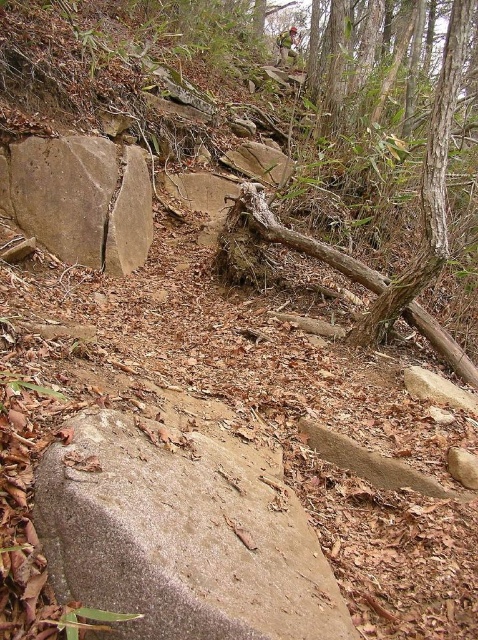
You are a hiker carrying a backpack and need to cross the path between the gray rough stone at center and the brown rough log at center. The path is narrow. If your backpack is 1.5 meters wide, can you safely pass through without touching either object?

The distance between the gray rough stone at center and the brown rough log at center is 1.77 meters. Since your backpack is 1.5 meters wide, there is enough space to pass safely without touching either object.

You are a hiker carrying a backpack and need to place your foot on the gray rough stone at center to cross a small stream. The brown rough rock at upper left is nearby. How far apart are these two stepping stones?

The gray rough stone at center is 7.81 feet away from the brown rough rock at upper left, so the distance between them is 7.81 feet.